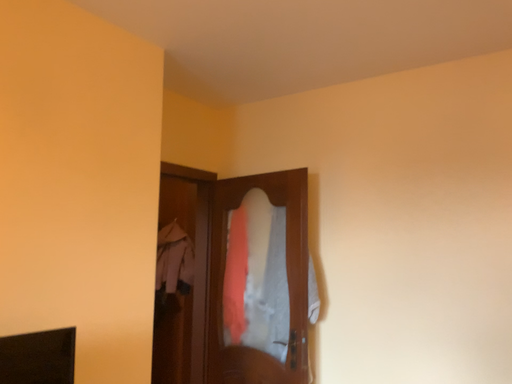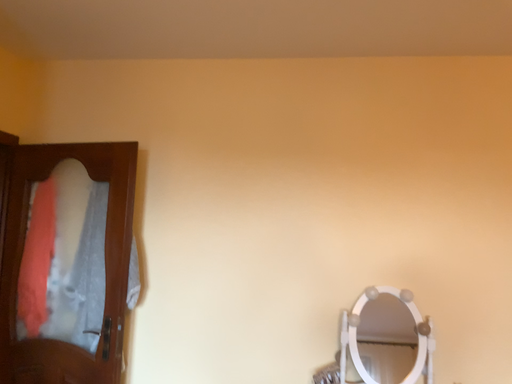
Question: Which way did the camera rotate in the video?

Choices:
 (A) rotated right
 (B) rotated left

Answer: (A)